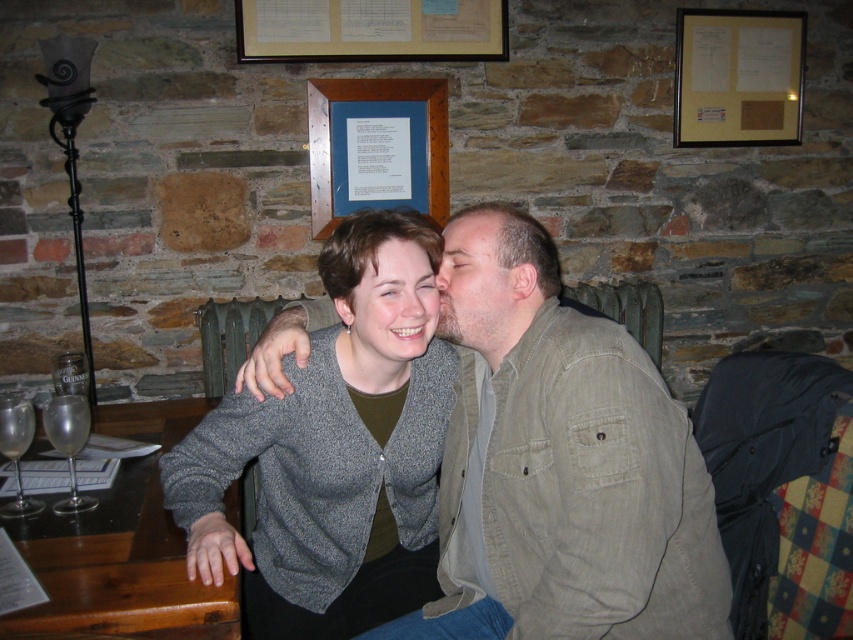
Does point (511, 248) come in front of point (310, 13)?

Yes, it is.

The image size is (853, 640). What do you see at coordinates (573, 483) in the screenshot? I see `light brown cotton shirt at center` at bounding box center [573, 483].

The height and width of the screenshot is (640, 853). In order to click on light brown cotton shirt at center in this screenshot , I will do [x=573, y=483].

Is blue matte picture frame at upper center above clear glass wine glass at lower left?

Indeed, blue matte picture frame at upper center is positioned over clear glass wine glass at lower left.

Between blue matte picture frame at upper center and clear glass wine glass at lower left, which one has more height?

With more height is blue matte picture frame at upper center.

Find the location of a particular element. blue matte picture frame at upper center is located at coordinates (376, 147).

Which of these two, gray wool sweater at center or clear glass wine glass at lower left, stands taller?

gray wool sweater at center is taller.

Which is above, gray wool sweater at center or clear glass wine glass at lower left?

clear glass wine glass at lower left is higher up.

Is point (279, 627) less distant than point (76, 493)?

Yes, it is in front of point (76, 493).

You are a GUI agent. You are given a task and a screenshot of the screen. Output one action in this format:
    pyautogui.click(x=<x>, y=<y>)
    Task: Click on the gray wool sweater at center
    The width and height of the screenshot is (853, 640).
    Given the screenshot: What is the action you would take?
    pyautogui.click(x=334, y=451)